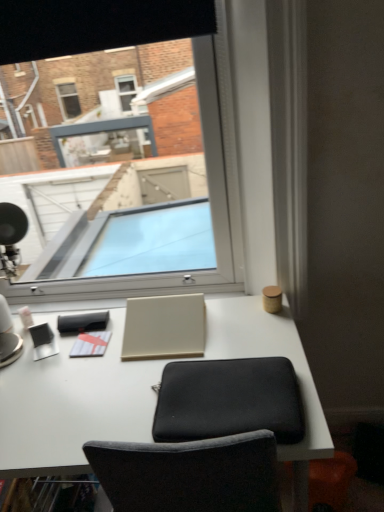
At what (x,y) coordinates should I click in order to perform the action: click on black fabric computer chair at center. Please return your answer as a coordinate pair (x, y). The image size is (384, 512). Looking at the image, I should click on (228, 400).

Considering the relative sizes of white matte notepad at center, which ranks as the 1th notepad in bottom-to-top order, and beige matte laptop at center in the image provided, is white matte notepad at center, which ranks as the 1th notepad in bottom-to-top order, wider than beige matte laptop at center?

In fact, white matte notepad at center, which ranks as the 1th notepad in bottom-to-top order, might be narrower than beige matte laptop at center.

Is white matte notepad at center, which ranks as the 1th notepad in bottom-to-top order, facing towards beige matte laptop at center?

No.

Choose the correct answer: Is white matte notepad at center, which is counted as the 2th notepad, starting from the back, inside beige matte laptop at center or outside it?

white matte notepad at center, which is counted as the 2th notepad, starting from the back, cannot be found inside beige matte laptop at center.

Is white matte notepad at center, which ranks as the 1th notepad in bottom-to-top order, far away from beige matte laptop at center?

That's not correct — white matte notepad at center, which ranks as the 1th notepad in bottom-to-top order, is a little close to beige matte laptop at center.

Is transparent glass window at center further to the viewer compared to matte white notepad at center, marked as the 1th notepad in a top-to-bottom arrangement?

No, transparent glass window at center is closer to the camera.

Is transparent glass window at center far away from matte white notepad at center, marked as the 1th notepad in a top-to-bottom arrangement?

That's not correct — transparent glass window at center is a little close to matte white notepad at center, marked as the 1th notepad in a top-to-bottom arrangement.

In terms of height, does transparent glass window at center look taller or shorter compared to matte white notepad at center, arranged as the second notepad when ordered from the bottom?

Clearly, transparent glass window at center is taller compared to matte white notepad at center, arranged as the second notepad when ordered from the bottom.

This screenshot has width=384, height=512. There is a black fabric computer chair at center. Find the location of `the 1st notepad above it (from the image's perspective)`. the 1st notepad above it (from the image's perspective) is located at coordinates (90, 344).

Which is behind, black fabric computer chair at center or white matte notepad at center, positioned as the 1th notepad in front-to-back order?

white matte notepad at center, positioned as the 1th notepad in front-to-back order, is further from the camera.

From a real-world perspective, between black fabric computer chair at center and white matte notepad at center, positioned as the 1th notepad in front-to-back order, who is vertically lower?

white matte notepad at center, positioned as the 1th notepad in front-to-back order, is physically lower.

In the scene shown: From a real-world perspective, is beige matte laptop at center beneath matte white notepad at center, arranged as the second notepad when ordered from the bottom?

No, from a real-world perspective, beige matte laptop at center is not below matte white notepad at center, arranged as the second notepad when ordered from the bottom.

Between beige matte laptop at center and matte white notepad at center, the 1th notepad in the back-to-front sequence, which one appears on the right side from the viewer's perspective?

From the viewer's perspective, beige matte laptop at center appears more on the right side.

Is matte white notepad at center, the 1th notepad in the back-to-front sequence, surrounded by beige matte laptop at center?

No, matte white notepad at center, the 1th notepad in the back-to-front sequence, is not a part of beige matte laptop at center.

Who is smaller, beige matte laptop at center or matte white notepad at center, marked as the 2th notepad in a front-to-back arrangement?

matte white notepad at center, marked as the 2th notepad in a front-to-back arrangement, is smaller.

Is transparent glass window at center not within white matte notepad at center, which ranks as the 2th notepad in top-to-bottom order?

transparent glass window at center lies outside white matte notepad at center, which ranks as the 2th notepad in top-to-bottom order,'s area.

Is point (128, 234) in front of point (70, 351)?

That is False.

Which is more to the left, transparent glass window at center or white matte notepad at center, which ranks as the 1th notepad in bottom-to-top order?

Positioned to the left is white matte notepad at center, which ranks as the 1th notepad in bottom-to-top order.

What's the angular difference between transparent glass window at center and white matte notepad at center, which ranks as the 1th notepad in bottom-to-top order,'s facing directions?

transparent glass window at center and white matte notepad at center, which ranks as the 1th notepad in bottom-to-top order, are facing 0.308 degrees away from each other.

Is white matte notepad at center, which is counted as the 2th notepad, starting from the back, further to the viewer compared to black fabric computer chair at center?

Yes, it is.

Is white matte notepad at center, which ranks as the 1th notepad in bottom-to-top order, spatially inside black fabric computer chair at center, or outside of it?

white matte notepad at center, which ranks as the 1th notepad in bottom-to-top order, is outside black fabric computer chair at center.

Is white matte notepad at center, which ranks as the 2th notepad in top-to-bottom order, facing away from black fabric computer chair at center?

No, white matte notepad at center, which ranks as the 2th notepad in top-to-bottom order, is not facing away from black fabric computer chair at center.

Is beige matte laptop at center facing towards black fabric computer chair at center?

Yes, beige matte laptop at center is facing black fabric computer chair at center.

In the scene shown: Is beige matte laptop at center spatially inside black fabric computer chair at center, or outside of it?

beige matte laptop at center is located beyond the bounds of black fabric computer chair at center.

Which is behind, point (172, 303) or point (230, 389)?

The point (172, 303) is more distant.

Find the location of `the 2nd notepad below the beige matte laptop at center (from the image's perspective)`. the 2nd notepad below the beige matte laptop at center (from the image's perspective) is located at coordinates (90, 344).

Where is `the 2nd notepad behind the transparent glass window at center, counting from the anchor's position`? the 2nd notepad behind the transparent glass window at center, counting from the anchor's position is located at coordinates click(x=82, y=322).

Considering their positions, is white matte notepad at center, which ranks as the 2th notepad in top-to-bottom order, positioned further to matte white notepad at center, arranged as the second notepad when ordered from the bottom, than transparent glass window at center?

transparent glass window at center is positioned further to the anchor matte white notepad at center, arranged as the second notepad when ordered from the bottom.

Considering their positions, is transparent glass window at center positioned closer to white matte desk at center than white matte notepad at center, positioned as the 1th notepad in front-to-back order?

white matte notepad at center, positioned as the 1th notepad in front-to-back order, is positioned closer to the anchor white matte desk at center.

From the image, which object appears to be farther from white matte notepad at center, which is counted as the 2th notepad, starting from the back, transparent glass window at center or white matte desk at center?

transparent glass window at center.

Considering their positions, is matte white notepad at center, arranged as the second notepad when ordered from the bottom, positioned further to transparent glass window at center than black fabric computer chair at center?

black fabric computer chair at center.

Which object lies nearer to the anchor point beige matte laptop at center, white matte desk at center or matte white notepad at center, marked as the 1th notepad in a top-to-bottom arrangement?

The object closer to beige matte laptop at center is white matte desk at center.

Looking at the image, which one is located further to white matte desk at center, white matte notepad at center, which is counted as the 2th notepad, starting from the back, or matte white notepad at center, the 1th notepad in the back-to-front sequence?

Based on the image, matte white notepad at center, the 1th notepad in the back-to-front sequence, appears to be further to white matte desk at center.

Considering their positions, is white matte notepad at center, which ranks as the 1th notepad in bottom-to-top order, positioned closer to beige matte laptop at center than white matte desk at center?

white matte desk at center lies closer to beige matte laptop at center than the other object.

When comparing their distances from white matte notepad at center, which ranks as the 1th notepad in bottom-to-top order, does black fabric computer chair at center or matte white notepad at center, arranged as the second notepad when ordered from the bottom, seem further?

black fabric computer chair at center is further to white matte notepad at center, which ranks as the 1th notepad in bottom-to-top order.

Where is `computer chair between beige matte laptop at center and white matte desk at center vertically`? computer chair between beige matte laptop at center and white matte desk at center vertically is located at coordinates (228, 400).

I want to click on laptop between transparent glass window at center and matte white notepad at center, the 1th notepad in the back-to-front sequence, in the up-down direction, so click(x=164, y=327).

The height and width of the screenshot is (512, 384). Find the location of `laptop between transparent glass window at center and white matte desk at center from top to bottom`. laptop between transparent glass window at center and white matte desk at center from top to bottom is located at coordinates (164, 327).

This screenshot has width=384, height=512. Find the location of `computer chair between white matte desk at center and matte white notepad at center, marked as the 1th notepad in a top-to-bottom arrangement, from front to back`. computer chair between white matte desk at center and matte white notepad at center, marked as the 1th notepad in a top-to-bottom arrangement, from front to back is located at coordinates (228, 400).